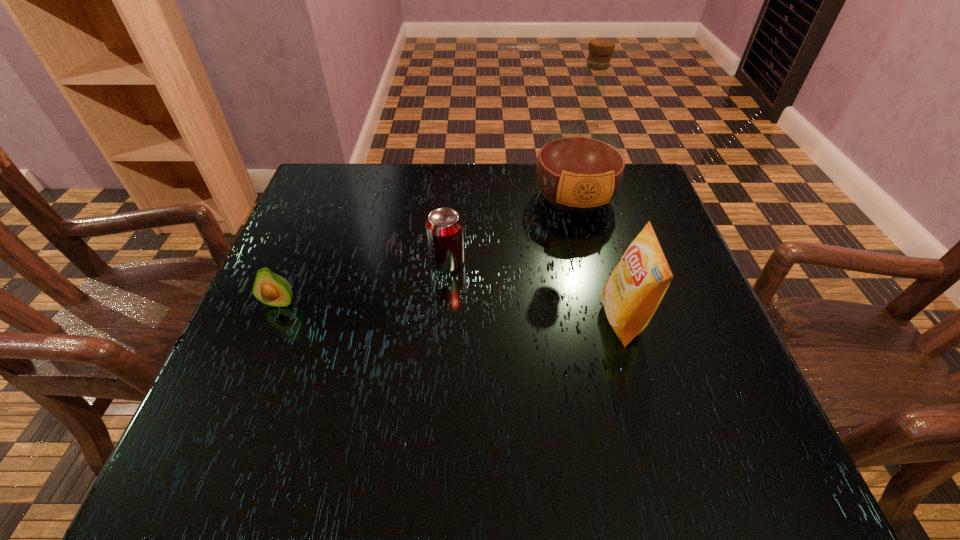
At what (x,y) coordinates should I click in order to perform the action: click on liquor. Please return your answer as a coordinate pair (x, y). The image size is (960, 540). Looking at the image, I should click on (580, 168).

The width and height of the screenshot is (960, 540). I want to click on the tallest object, so 580,168.

What are the coordinates of `crisp (potato chip)` in the screenshot? It's located at (631, 295).

You are a GUI agent. You are given a task and a screenshot of the screen. Output one action in this format:
    pyautogui.click(x=<x>, y=<y>)
    Task: Click on the second shortest object
    The height and width of the screenshot is (540, 960).
    Given the screenshot: What is the action you would take?
    pyautogui.click(x=444, y=228)

This screenshot has height=540, width=960. In order to click on the third object from right to left in this screenshot , I will do `click(444, 228)`.

I want to click on the shortest object, so click(x=269, y=288).

Find the location of `avocado`. avocado is located at coordinates (269, 288).

This screenshot has height=540, width=960. Identify the location of blank area located on the front label of the liquor. (608, 334).

The height and width of the screenshot is (540, 960). I want to click on free spot located on the front-facing side of the third shortest object, so click(x=458, y=319).

At what (x,y) coordinates should I click in order to perform the action: click on vacant space located 0.140m on the front-facing side of the third shortest object. Please return your answer as a coordinate pair (x, y). Looking at the image, I should click on (530, 319).